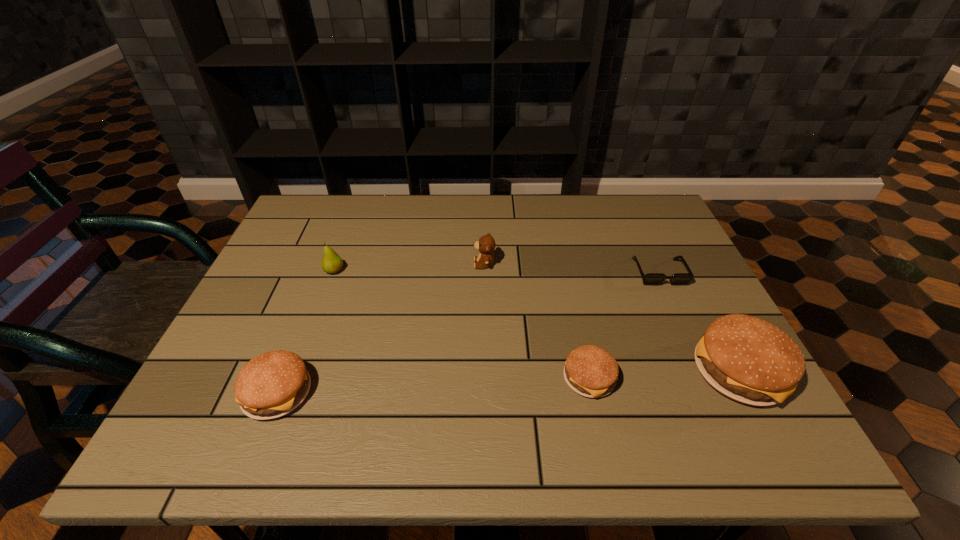
If we want them evenly spaced by inserting an extra hamburger among them, please locate a free spot for this new hamburger. Please provide its 2D coordinates. Your answer should be formatted as a tuple, i.e. [(x, y)], where the tuple contains the x and y coordinates of a point satisfying the conditions above.

[(435, 386)]